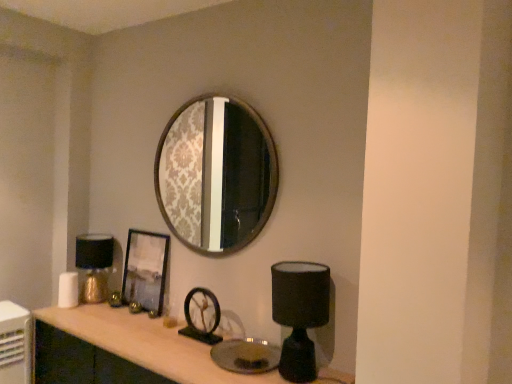
Question: Would you say black matte table lamp at lower right, acting as the first table lamp starting from the right, is to the left or to the right of metallic silver picture frame at center in the picture?

Choices:
 (A) left
 (B) right

Answer: (B)

Question: In terms of height, does black matte table lamp at lower right, placed as the 1th table lamp when sorted from front to back, look taller or shorter compared to metallic silver picture frame at center?

Choices:
 (A) short
 (B) tall

Answer: (A)

Question: Based on their relative distances, which object is nearer to the wooden frame mirror at upper center?

Choices:
 (A) gold metallic table lamp at left, which is the 2th table lamp from front to back
 (B) black matte table lamp at lower right, acting as the first table lamp starting from the right
 (C) matte wood computer desk at center
 (D) metallic silver picture frame at center

Answer: (A)

Question: Considering the real-world distances, which object is farthest from the wooden frame mirror at upper center?

Choices:
 (A) metallic silver picture frame at center
 (B) gold metallic table lamp at left, placed as the 2th table lamp when sorted from right to left
 (C) black matte table lamp at lower right, which ranks as the second table lamp in back-to-front order
 (D) matte wood computer desk at center

Answer: (C)